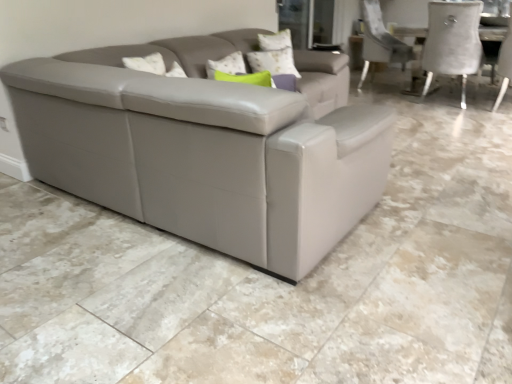
Question: In terms of height, does transparent glass door at upper center look taller or shorter compared to white textured pillow at upper center?

Choices:
 (A) short
 (B) tall

Answer: (B)

Question: Looking at their shapes, would you say transparent glass door at upper center is wider or thinner than white textured pillow at upper center?

Choices:
 (A) thin
 (B) wide

Answer: (A)

Question: Estimate the real-world distances between objects in this image. Which object is farther from the white textured pillow at upper center?

Choices:
 (A) white fabric chair at right
 (B) transparent glass door at upper center
 (C) matte gray couch at center

Answer: (A)

Question: Based on their relative distances, which object is farther from the white fabric chair at right?

Choices:
 (A) white textured pillow at upper center
 (B) matte gray couch at center
 (C) transparent glass door at upper center

Answer: (B)